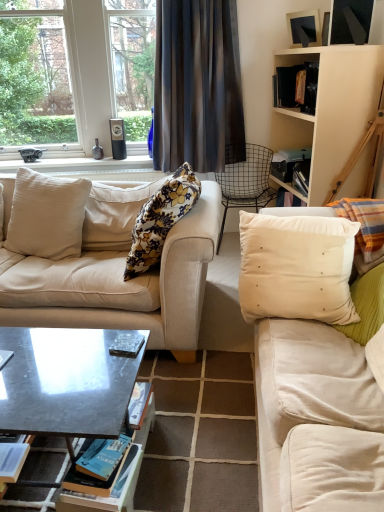
You are a GUI agent. You are given a task and a screenshot of the screen. Output one action in this format:
    pyautogui.click(x=<x>, y=<y>)
    Task: Click on the free point in front of wooden book at center, which ranks as the 1th book in top-to-bottom order
    
    Given the screenshot: What is the action you would take?
    pyautogui.click(x=105, y=377)